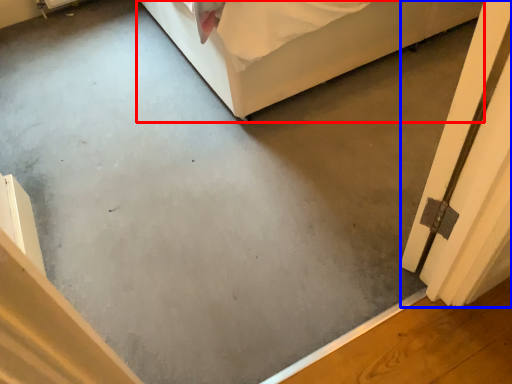
Question: Which point is further to the camera, furniture (highlighted by a red box) or screen door (highlighted by a blue box)?

Choices:
 (A) furniture
 (B) screen door

Answer: (A)